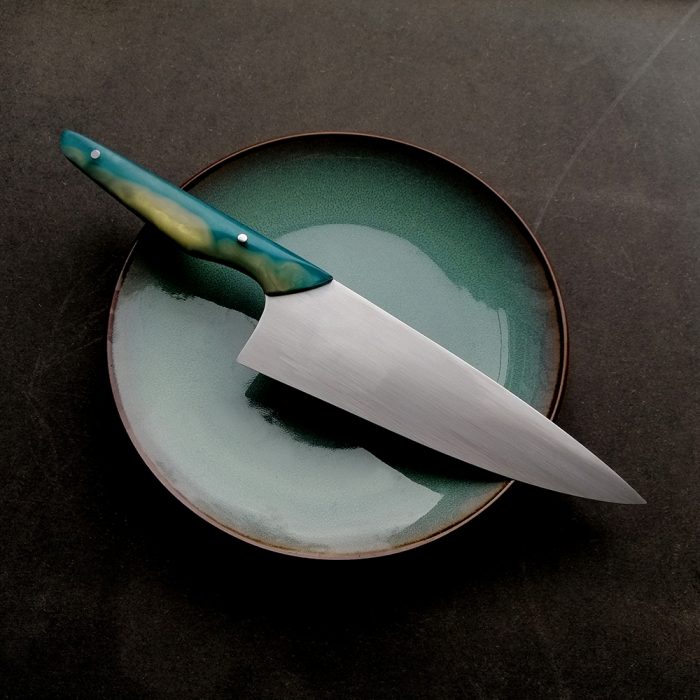
Find the location of a particular element. The height and width of the screenshot is (700, 700). table is located at coordinates (537, 101).